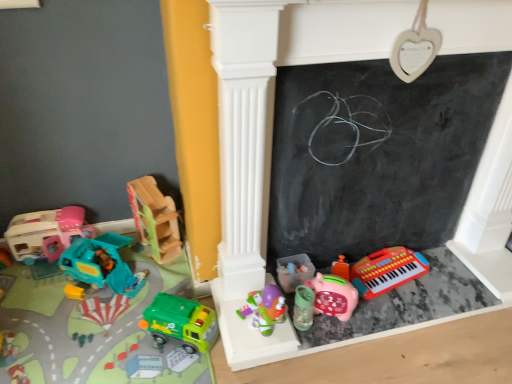
This screenshot has width=512, height=384. In order to click on vacant space in front of green plastic toy truck at lower left, the fourth toy positioned from the left in this screenshot , I will do `click(176, 366)`.